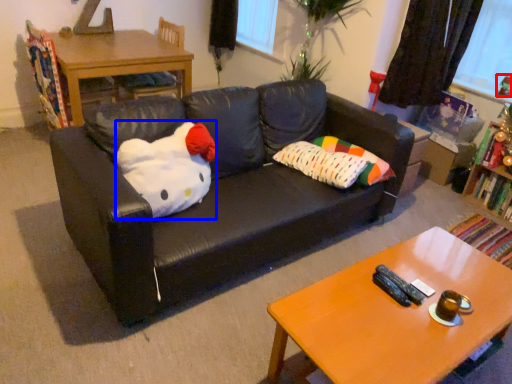
Question: Among these objects, which one is farthest to the camera, toy (highlighted by a red box) or animal (highlighted by a blue box)?

Choices:
 (A) toy
 (B) animal

Answer: (A)